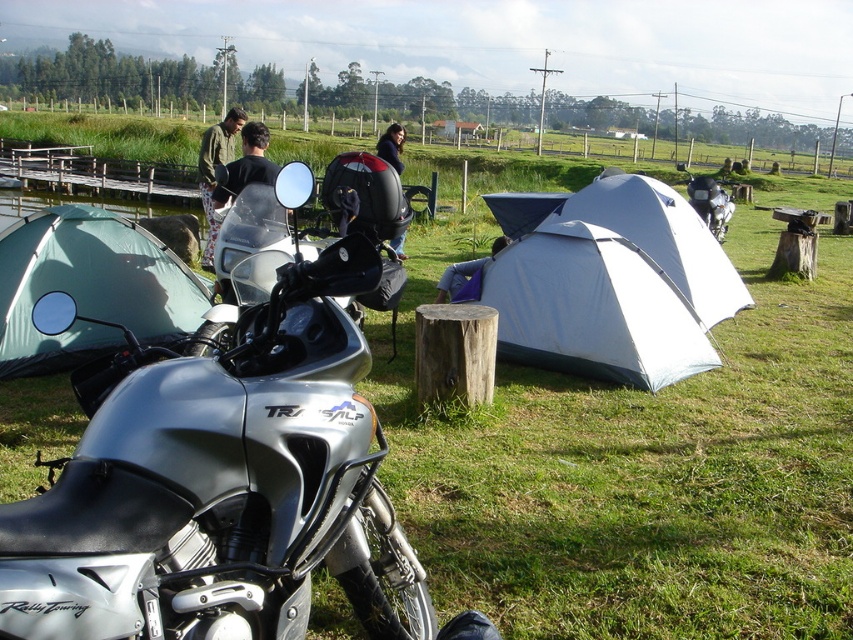
Which is above, green fabric pants at center or dark blue fabric jacket at center?

Positioned higher is green fabric pants at center.

The width and height of the screenshot is (853, 640). What do you see at coordinates (213, 170) in the screenshot? I see `green fabric pants at center` at bounding box center [213, 170].

The image size is (853, 640). In order to click on green fabric pants at center in this screenshot , I will do (x=213, y=170).

Who is shorter, silver metallic motorcycle at center or metallic silver motorcycle at center?

Standing shorter between the two is silver metallic motorcycle at center.

Is point (254, 570) closer to camera compared to point (720, 218)?

Yes.

The image size is (853, 640). What are the coordinates of `silver metallic motorcycle at center` in the screenshot? It's located at (221, 483).

Can you confirm if silver metallic motorcycle at center is positioned above blue fabric bag at center?

No, silver metallic motorcycle at center is not above blue fabric bag at center.

Which of these two, silver metallic motorcycle at center or blue fabric bag at center, stands shorter?

Standing shorter between the two is blue fabric bag at center.

The height and width of the screenshot is (640, 853). Find the location of `silver metallic motorcycle at center`. silver metallic motorcycle at center is located at coordinates (221, 483).